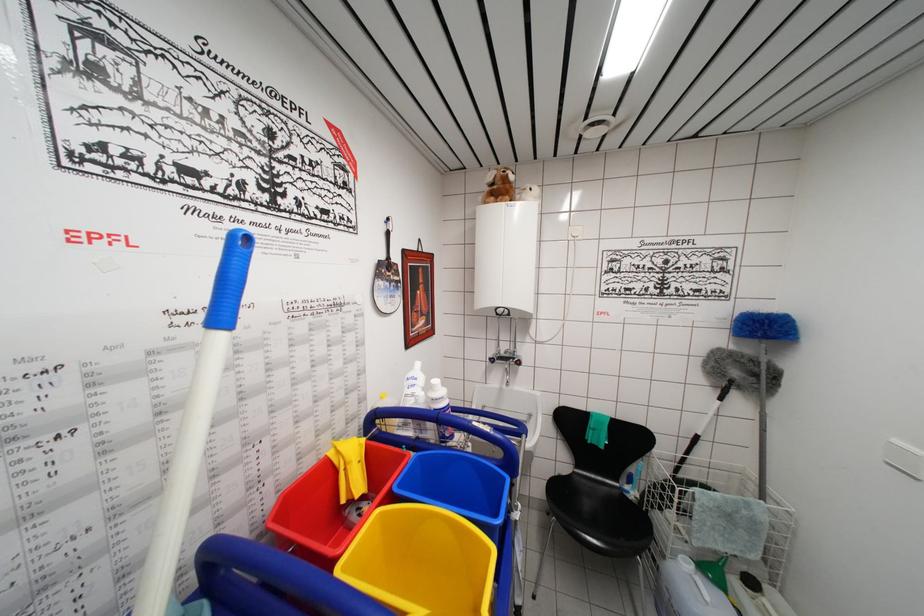
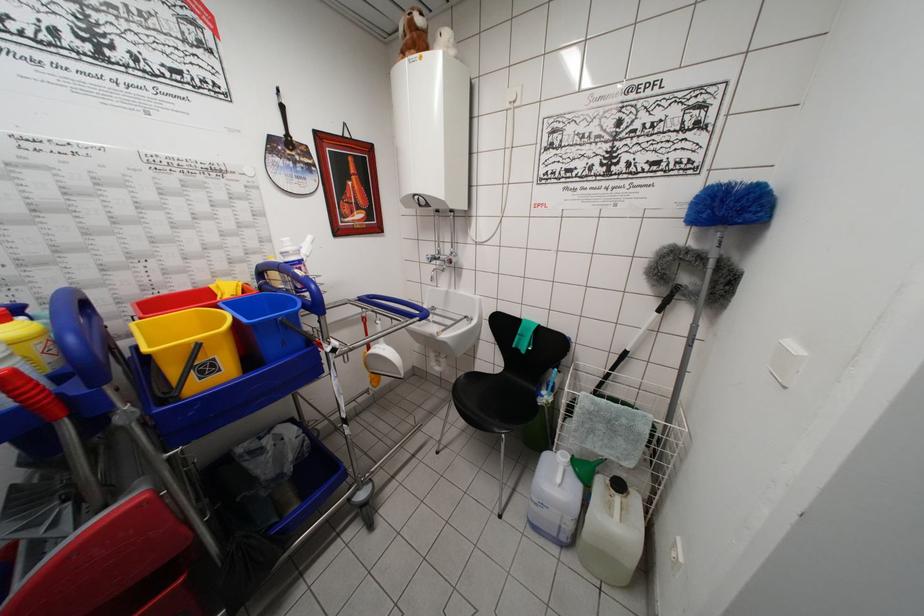
Find the pixel in the second image that matches the point at 743,582 in the first image.

(614, 483)